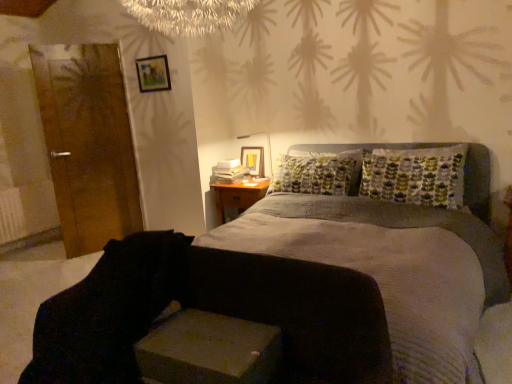
Question: From the image's perspective, is white plastic table lamp at upper center above or below wooden door at left?

Choices:
 (A) below
 (B) above

Answer: (A)

Question: Visually, is white plastic table lamp at upper center positioned to the left or to the right of wooden door at left?

Choices:
 (A) right
 (B) left

Answer: (A)

Question: Considering the real-world distances, which object is closest to the black fabric swivel chair at lower left?

Choices:
 (A) white plastic table lamp at upper center
 (B) wooden frame at upper left
 (C) wooden door at left
 (D) woodennightstand at right
 (E) textured gray bed at center

Answer: (E)

Question: Which object is the farthest from the textured gray bed at center?

Choices:
 (A) black fabric swivel chair at lower left
 (B) wooden frame at upper left
 (C) woodennightstand at right
 (D) wooden door at left
 (E) white plastic table lamp at upper center

Answer: (D)